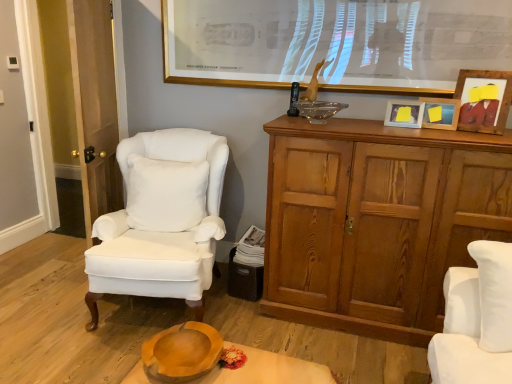
Identify the location of vacant area that lies in front of yellow paper picture frame at upper center, placed as the third picture frame when sorted from left to right. The height and width of the screenshot is (384, 512). (449, 128).